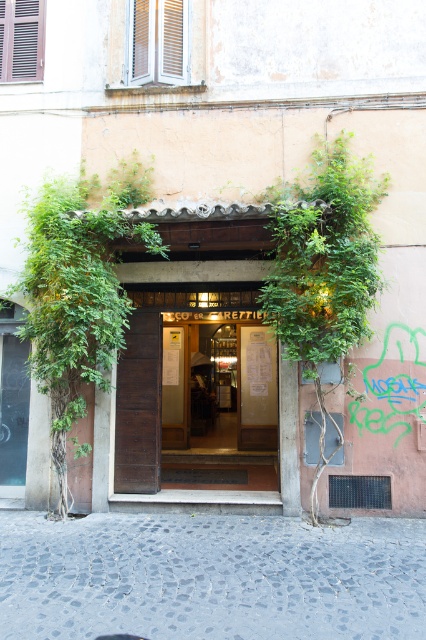
You are a delivery person trying to enter the establishment. You see the green leafy plant at center and the wooden door at center. Which one is taller? Please answer based on the scene description.

The green leafy plant at center is taller than the wooden door at center.

You are a delivery person with a cart that is 2 meters wide. You need to deliver a package to the entrance of the establishment. Can your cart fit through the space between the green leafy plant at center and the wooden door at center?

The space between the green leafy plant at center and the wooden door at center is 6.55 meters. Since your cart is only 2 meters wide, it can easily fit through the space between the green leafy plant at center and the wooden door at center.